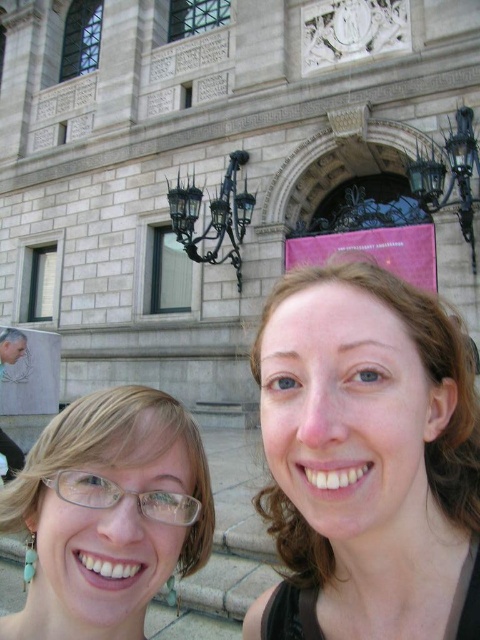
Consider the image. Can you confirm if smooth skin face at center is shorter than clear plastic glasses at center?

No.

Does point (436, 342) lie in front of point (29, 596)?

Yes, point (436, 342) is in front of point (29, 596).

Image resolution: width=480 pixels, height=640 pixels. In order to click on smooth skin face at center in this screenshot , I will do [368, 449].